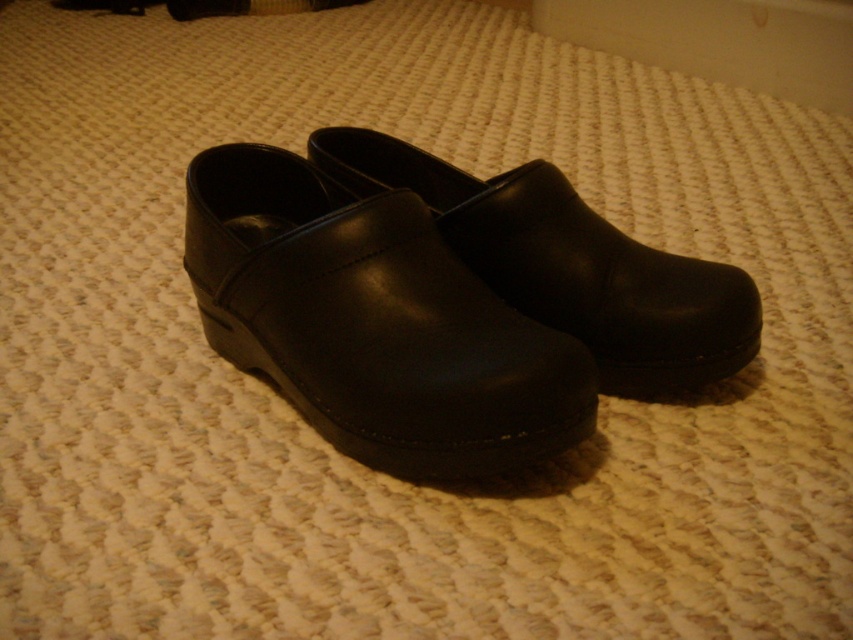
Question: Which point appears closest to the camera in this image?

Choices:
 (A) (560, 310)
 (B) (338, 326)

Answer: (B)

Question: Does black leather clogs at center have a greater width compared to black leather clog at center?

Choices:
 (A) no
 (B) yes

Answer: (A)

Question: Does black leather clogs at center have a larger size compared to black leather clog at center?

Choices:
 (A) no
 (B) yes

Answer: (B)

Question: Is black leather clogs at center positioned in front of black leather clog at center?

Choices:
 (A) yes
 (B) no

Answer: (A)